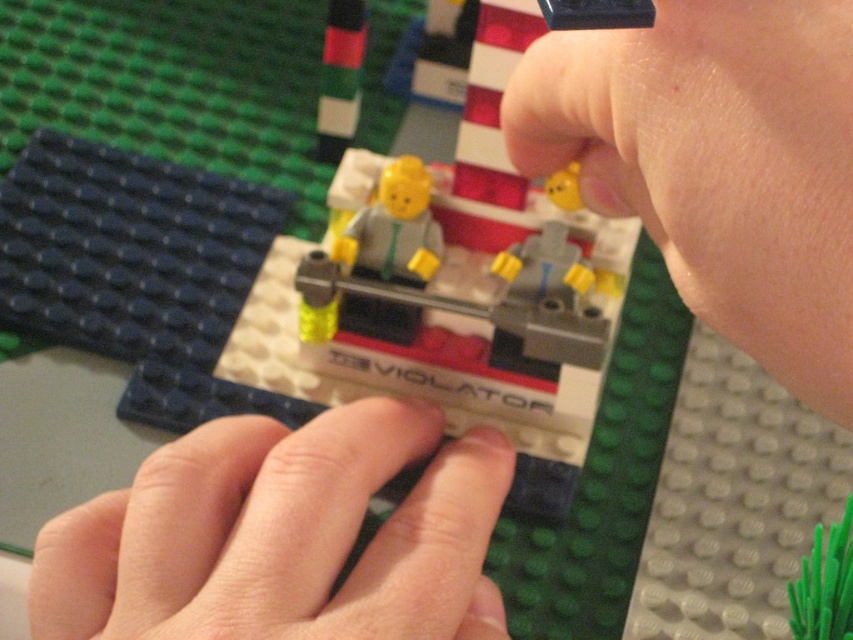
Question: Does smooth skin at center have a greater width compared to matte gray figure at center?

Choices:
 (A) yes
 (B) no

Answer: (A)

Question: Estimate the real-world distances between objects in this image. Which object is farther from the matte gray figure at center?

Choices:
 (A) smooth skin at upper right
 (B) smooth skin at center

Answer: (A)

Question: Which point appears farthest from the camera in this image?

Choices:
 (A) (415, 260)
 (B) (230, 570)
 (C) (625, 52)

Answer: (A)

Question: Is smooth skin at upper right closer to camera compared to smooth skin at center?

Choices:
 (A) no
 (B) yes

Answer: (B)

Question: Considering the relative positions of smooth skin at upper right and smooth skin at center in the image provided, where is smooth skin at upper right located with respect to smooth skin at center?

Choices:
 (A) below
 (B) above

Answer: (B)

Question: Which is farther from the smooth skin at upper right?

Choices:
 (A) smooth skin at center
 (B) matte gray figure at center

Answer: (B)